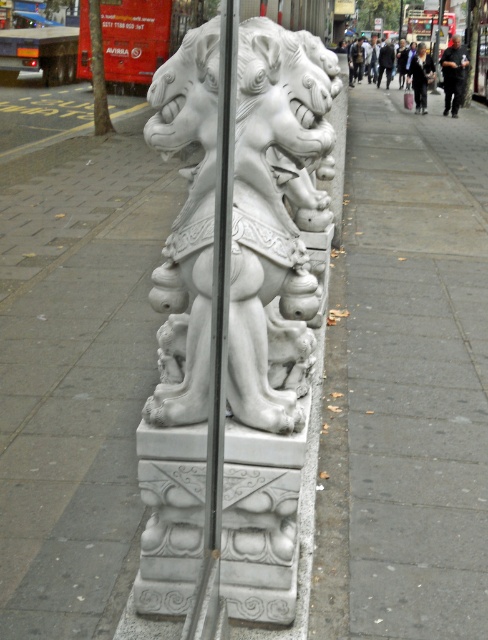
You are standing at the base of the mythical creature sculpture. You want to walk straight ahead towards the sidewalk. Will you step onto the gray concrete pavement at center represented by point (x=415, y=369)?

The gray concrete pavement at center is represented by point (x=415, y=369), so yes, walking straight ahead from the base of the sculpture will lead you to step onto the gray concrete pavement at center represented by point (x=415, y=369).

You are a delivery person trying to park your bike. The bike requires a space of 1.5 meters in width. You see the gray concrete pavement at center and the white stone lion at center. Which surface can accommodate your bike?

The gray concrete pavement at center has a larger width than the white stone lion at center, so the bike can be parked on the gray concrete pavement at center.

Consider the image. You are a delivery person who needs to park your 2.5 meters wide delivery van on the gray concrete pavement at center near the white stone lion at center. Considering the size of the pavement, will there be enough space for the van to park without overlapping the lion?

The gray concrete pavement at center is larger in size compared to the white stone lion at center, so there should be sufficient space for the 2.5 meters wide delivery van to park without overlapping the lion.